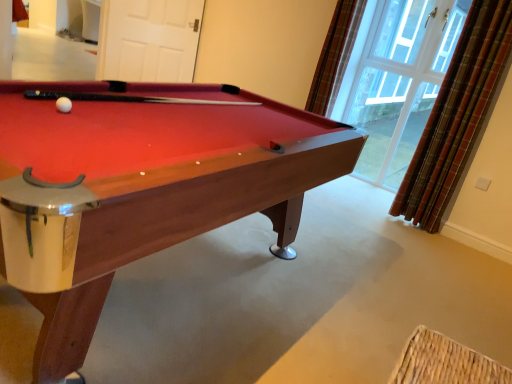
Question: Is clear glass window at upper right at the back of plaid fabric curtain at right, acting as the 1th curtain starting from the right?

Choices:
 (A) yes
 (B) no

Answer: (B)

Question: Is the position of plaid fabric curtain at right, the 2th curtain in the left-to-right sequence, less distant than that of clear glass window at upper right?

Choices:
 (A) yes
 (B) no

Answer: (A)

Question: Are plaid fabric curtain at right, the 2th curtain in the left-to-right sequence, and clear glass window at upper right far apart?

Choices:
 (A) no
 (B) yes

Answer: (A)

Question: Is plaid fabric curtain at right, acting as the 1th curtain starting from the right, shorter than clear glass window at upper right?

Choices:
 (A) no
 (B) yes

Answer: (B)

Question: From a real-world perspective, is plaid fabric curtain at right, the 2th curtain in the left-to-right sequence, under clear glass window at upper right?

Choices:
 (A) no
 (B) yes

Answer: (A)

Question: Does plaid fabric curtain at right, acting as the 1th curtain starting from the right, have a lesser width compared to clear glass window at upper right?

Choices:
 (A) no
 (B) yes

Answer: (A)

Question: Can you confirm if white matte door at upper center is bigger than clear glass window at upper right?

Choices:
 (A) yes
 (B) no

Answer: (A)

Question: Is white matte door at upper center positioned far away from clear glass window at upper right?

Choices:
 (A) yes
 (B) no

Answer: (A)

Question: Does white matte door at upper center appear on the right side of clear glass window at upper right?

Choices:
 (A) no
 (B) yes

Answer: (A)

Question: Is white matte door at upper center facing towards clear glass window at upper right?

Choices:
 (A) yes
 (B) no

Answer: (B)

Question: From the image's perspective, is white matte door at upper center over clear glass window at upper right?

Choices:
 (A) no
 (B) yes

Answer: (B)

Question: Is white matte door at upper center at the left side of clear glass window at upper right?

Choices:
 (A) no
 (B) yes

Answer: (B)

Question: Is wooden billiard table at center at the back of plaid fabric curtain at upper right, which ranks as the first curtain in left-to-right order?

Choices:
 (A) yes
 (B) no

Answer: (B)